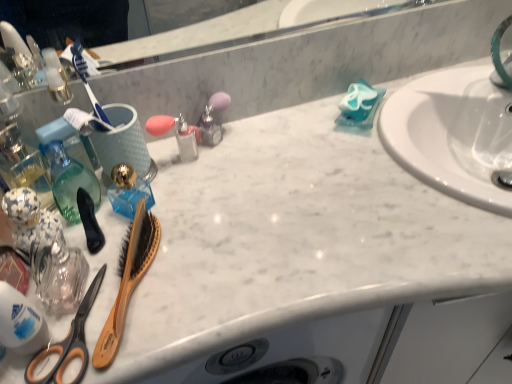
This screenshot has width=512, height=384. I want to click on spots to the right of translucent blue glass at center, so click(232, 213).